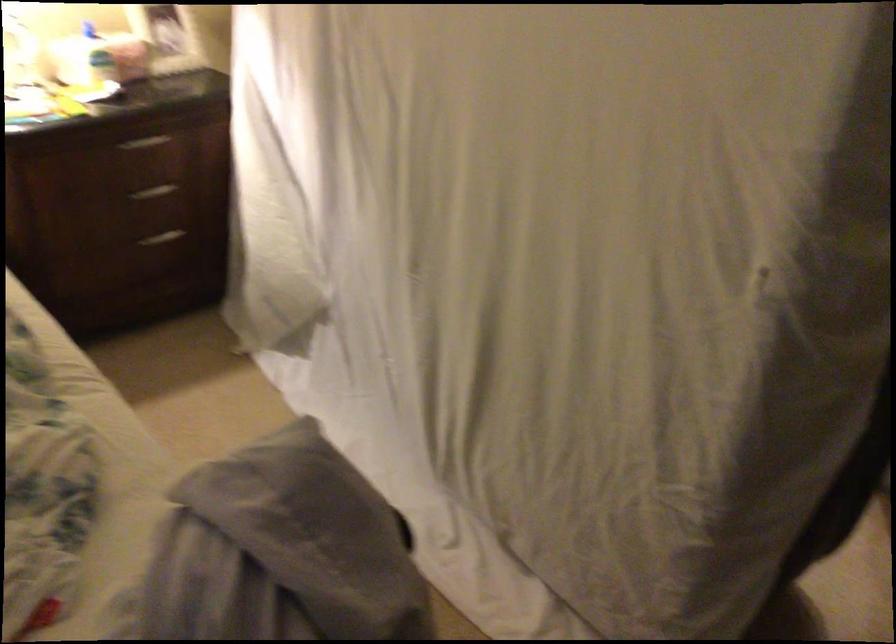
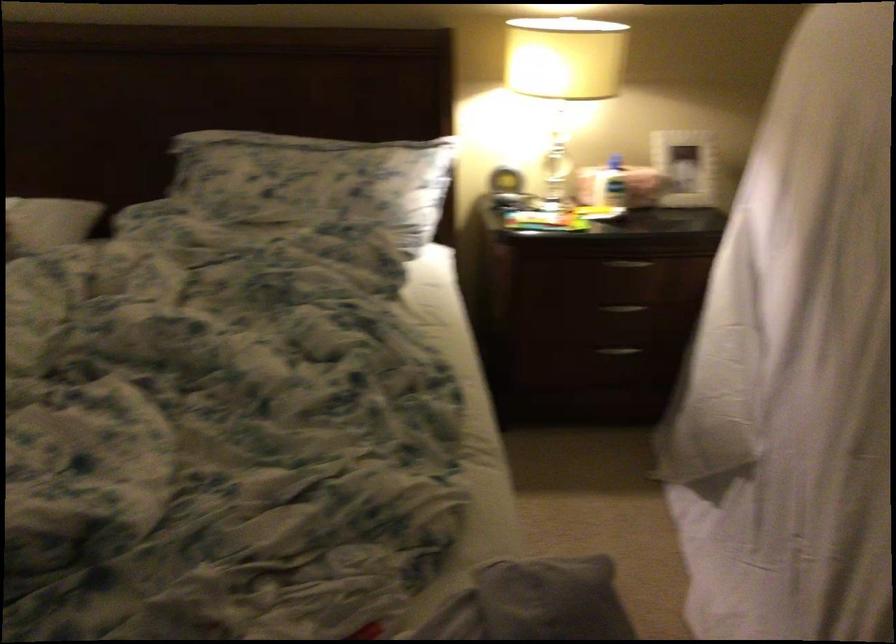
Find the pixel in the second image that matches pixel 143 149 in the first image.

(627, 263)